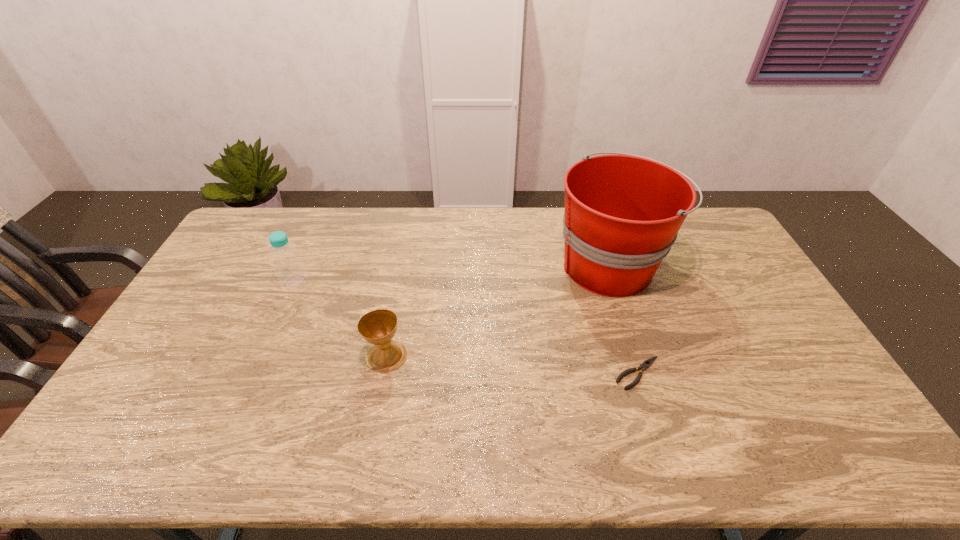
The height and width of the screenshot is (540, 960). I want to click on free point between the third object from right to left and the bucket, so pyautogui.click(x=498, y=311).

You are a GUI agent. You are given a task and a screenshot of the screen. Output one action in this format:
    pyautogui.click(x=<x>, y=<y>)
    Task: Click on the free point between the second tallest object and the third tallest object
    
    Given the screenshot: What is the action you would take?
    tap(341, 319)

Find the location of a particular element. Image resolution: width=960 pixels, height=540 pixels. free space between the bucket and the shortest object is located at coordinates (624, 319).

The height and width of the screenshot is (540, 960). Identify the location of free space between the second shortest object and the leftmost object. (341, 319).

Locate an element on the screen. Image resolution: width=960 pixels, height=540 pixels. empty space between the bottle and the bucket is located at coordinates (452, 274).

Where is `unoccupied position between the pliers and the leftmost object`? The image size is (960, 540). unoccupied position between the pliers and the leftmost object is located at coordinates (467, 328).

Locate which object ranks second in proximity to the chalice. Please provide its 2D coordinates. Your answer should be formatted as a tuple, i.e. [(x, y)], where the tuple contains the x and y coordinates of a point satisfying the conditions above.

[(623, 212)]

Identify which object is the closest to the leftmost object. Please provide its 2D coordinates. Your answer should be formatted as a tuple, i.e. [(x, y)], where the tuple contains the x and y coordinates of a point satisfying the conditions above.

[(378, 327)]

Where is `vacant space that satisfies the following two spatial constraints: 1. on the back side of the bucket; 2. on the left side of the shortest object`? This screenshot has width=960, height=540. vacant space that satisfies the following two spatial constraints: 1. on the back side of the bucket; 2. on the left side of the shortest object is located at coordinates (605, 266).

The width and height of the screenshot is (960, 540). I want to click on vacant position in the image that satisfies the following two spatial constraints: 1. on the back side of the third shortest object; 2. on the left side of the bucket, so click(302, 266).